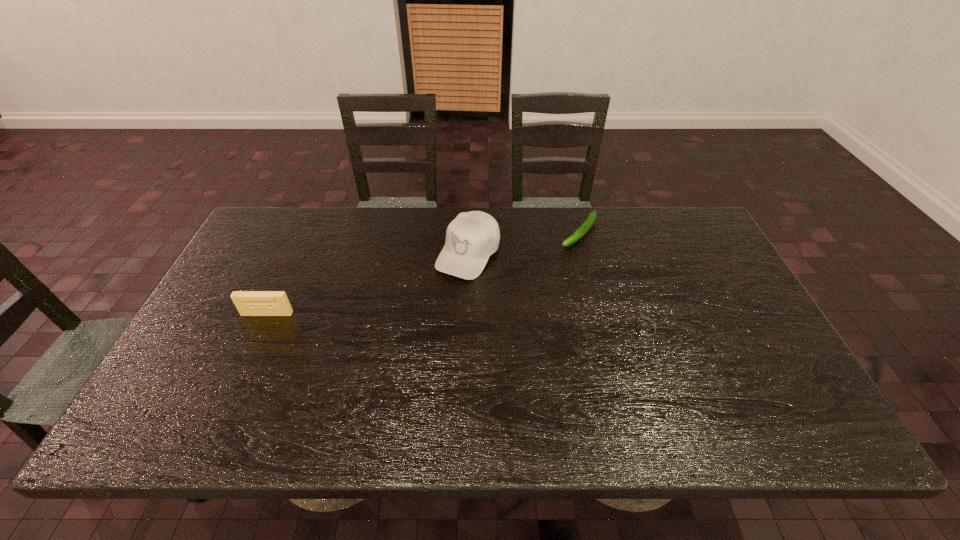
Where is `free space between the shortest object and the baseball cap`? The image size is (960, 540). free space between the shortest object and the baseball cap is located at coordinates (557, 292).

Identify the location of free space between the third object from right to left and the shortest object. (557, 292).

At what (x,y) coordinates should I click in order to perform the action: click on vacant point located between the leftmost object and the watch. Please return your answer as a coordinate pair (x, y). The image size is (960, 540). Looking at the image, I should click on (456, 322).

At what (x,y) coordinates should I click in order to perform the action: click on vacant region between the baseball cap and the third shortest object. Please return your answer as a coordinate pair (x, y). This screenshot has height=540, width=960. Looking at the image, I should click on (368, 284).

Where is `vacant area that lies between the shortest object and the videotape`? vacant area that lies between the shortest object and the videotape is located at coordinates (x=456, y=322).

Identify which object is located as the second nearest to the leftmost object. Please provide its 2D coordinates. Your answer should be formatted as a tuple, i.e. [(x, y)], where the tuple contains the x and y coordinates of a point satisfying the conditions above.

[(586, 226)]

Locate which object is the third closest to the zucchini. Please provide its 2D coordinates. Your answer should be formatted as a tuple, i.e. [(x, y)], where the tuple contains the x and y coordinates of a point satisfying the conditions above.

[(248, 303)]

Identify the location of vacant space that satisfies the following two spatial constraints: 1. on the front side of the zucchini; 2. on the face of the shortest object. (605, 330).

Where is `vacant space that satisfies the following two spatial constraints: 1. at the front of the third shortest object with spools; 2. on the face of the shortest object`? vacant space that satisfies the following two spatial constraints: 1. at the front of the third shortest object with spools; 2. on the face of the shortest object is located at coordinates (259, 330).

Where is `free space in the image that satisfies the following two spatial constraints: 1. at the front of the leftmost object with spools; 2. on the face of the watch`? The width and height of the screenshot is (960, 540). free space in the image that satisfies the following two spatial constraints: 1. at the front of the leftmost object with spools; 2. on the face of the watch is located at coordinates (259, 330).